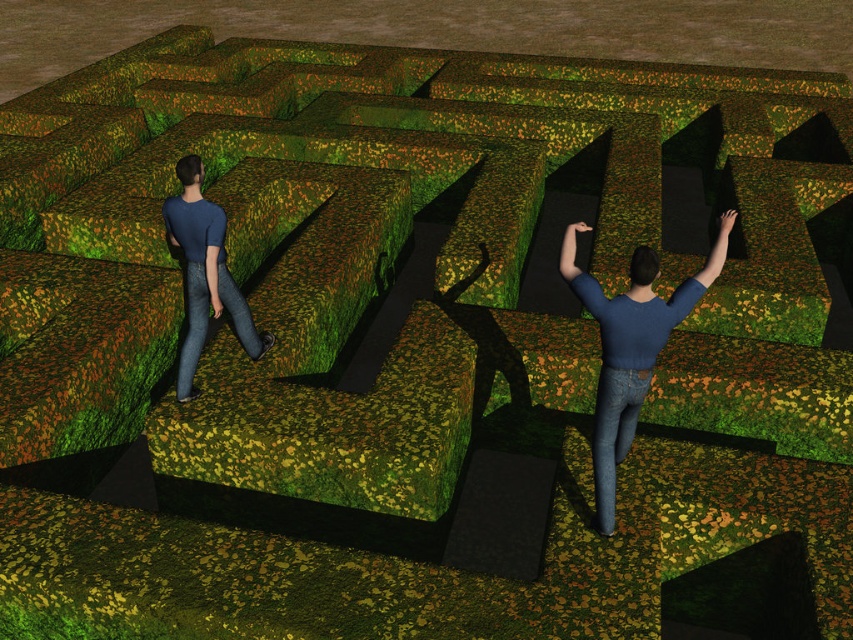
Can you confirm if denim at right is smaller than denim jeans at lower left?

Indeed, denim at right has a smaller size compared to denim jeans at lower left.

Who is shorter, denim at right or denim jeans at lower left?

denim at right

Who is more forward, (x=625, y=442) or (x=223, y=298)?

Point (x=625, y=442)

Find the location of `denim at right`. denim at right is located at coordinates (614, 433).

Between blue fabric arm at upper right and blue matte shirt at left, which one is positioned lower?

Positioned lower is blue matte shirt at left.

Is blue fabric arm at upper right thinner than blue matte shirt at left?

Incorrect, blue fabric arm at upper right's width is not less than blue matte shirt at left's.

What do you see at coordinates (717, 250) in the screenshot? I see `blue fabric arm at upper right` at bounding box center [717, 250].

You are a GUI agent. You are given a task and a screenshot of the screen. Output one action in this format:
    pyautogui.click(x=<x>, y=<y>)
    Task: Click on the blue fabric arm at upper right
    
    Given the screenshot: What is the action you would take?
    pyautogui.click(x=717, y=250)

Describe the element at coordinates (206, 273) in the screenshot. The height and width of the screenshot is (640, 853). I see `blue denim jeans at left` at that location.

You are a GUI agent. You are given a task and a screenshot of the screen. Output one action in this format:
    pyautogui.click(x=<x>, y=<y>)
    Task: Click on the blue denim jeans at left
    The height and width of the screenshot is (640, 853).
    Given the screenshot: What is the action you would take?
    pyautogui.click(x=206, y=273)